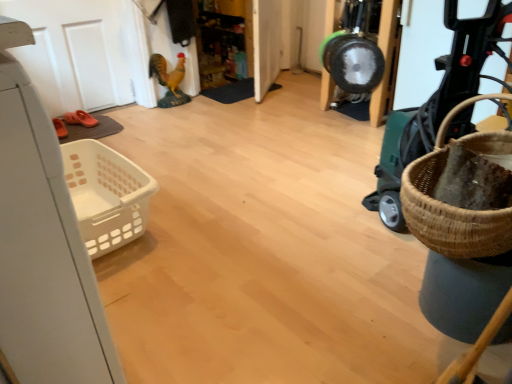
Identify the location of free point below shiny plastic rooster at upper center (from a real-world perspective). This screenshot has height=384, width=512. (170, 105).